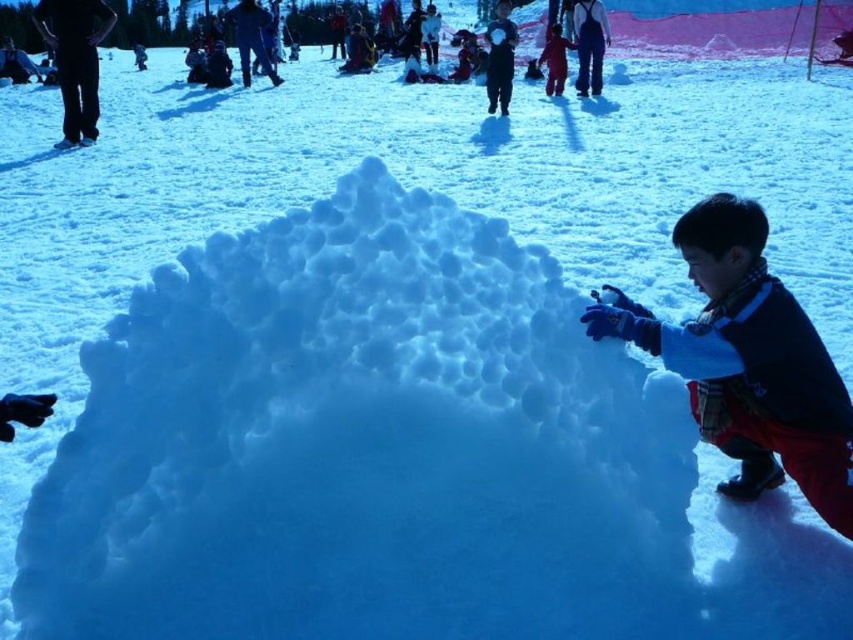
Is black pants at upper left positioned at the back of dark blue snowsuit at upper right?

No.

Where is `black pants at upper left`? This screenshot has width=853, height=640. black pants at upper left is located at coordinates (74, 60).

The image size is (853, 640). Identify the location of black pants at upper left. (74, 60).

Is point (578, 17) positioned before point (564, 51)?

That is True.

Who is lower down, dark blue snowsuit at upper right or matte red snowsuit at center?

dark blue snowsuit at upper right is lower down.

Is point (596, 10) positioned in front of point (554, 58)?

Yes.

The width and height of the screenshot is (853, 640). I want to click on dark blue snowsuit at upper right, so click(589, 44).

Image resolution: width=853 pixels, height=640 pixels. What are the coordinates of `dark blue wool scarf at lower right` in the screenshot? It's located at (750, 362).